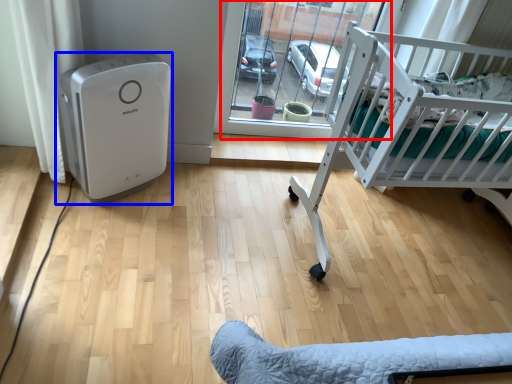
Question: Which point is closer to the camera, glass door (highlighted by a red box) or home appliance (highlighted by a blue box)?

Choices:
 (A) glass door
 (B) home appliance

Answer: (B)